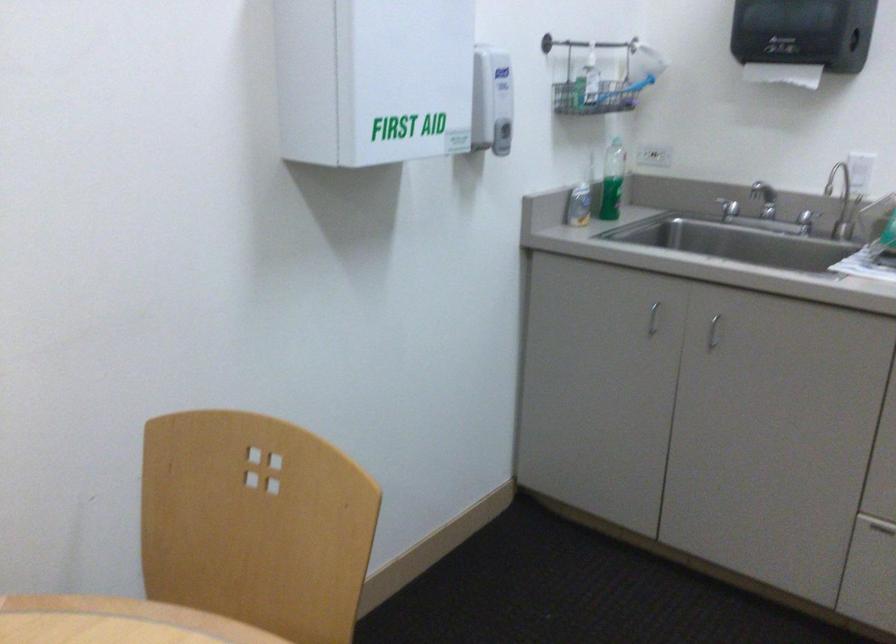
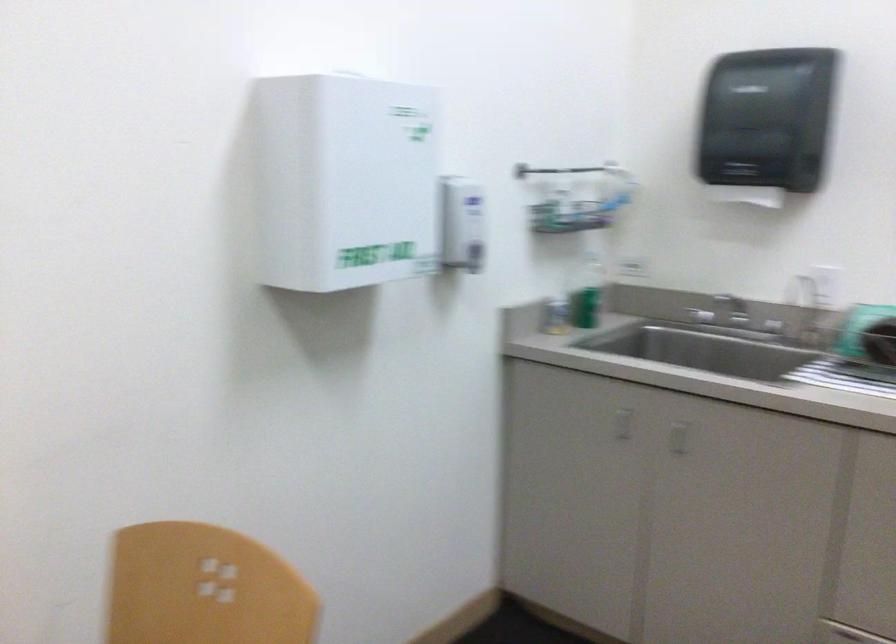
In a continuous first-person perspective shot, in which direction is the camera moving?

The movement direction of the cameraman is right, backward.